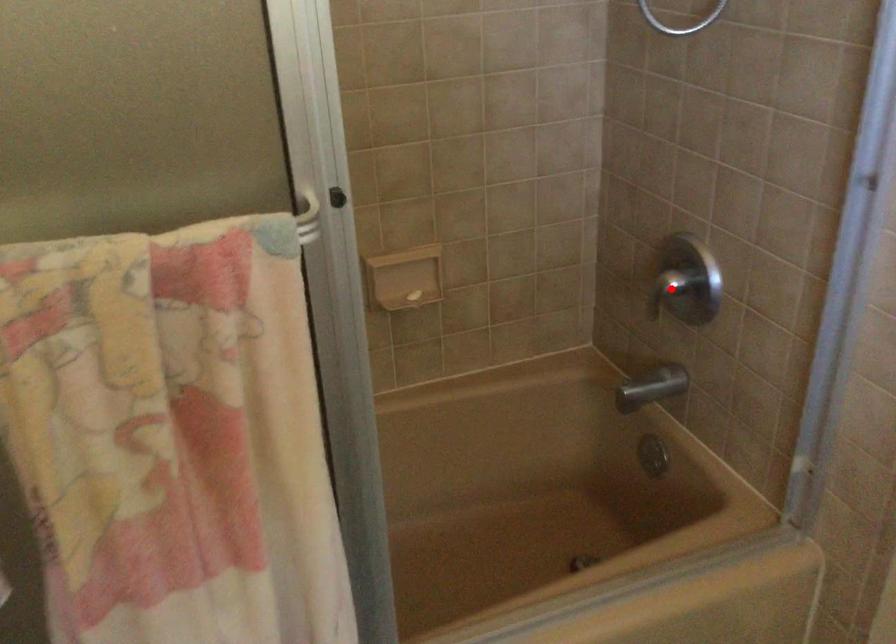
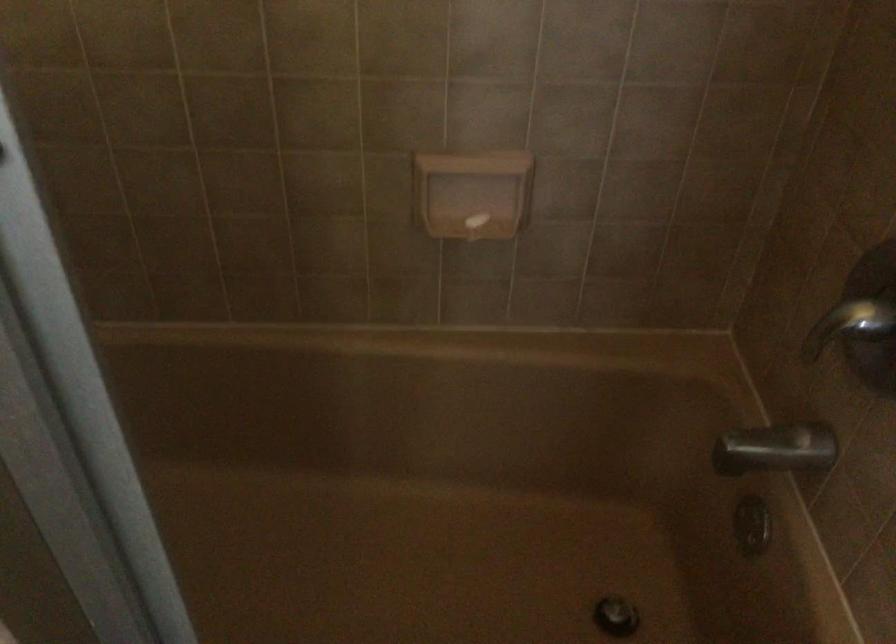
Question: I am providing you with two images of the same scene from different viewpoints. A red point is shown in image1. For the corresponding object point in image2, is it positioned nearer or farther from the camera?

Choices:
 (A) Nearer
 (B) Farther

Answer: (A)